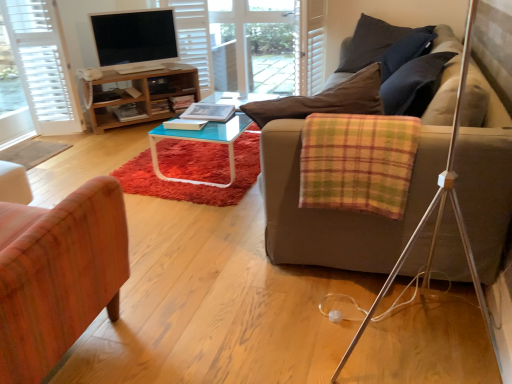
Question: From the image's perspective, is hardcover book at center, arranged as the first book when viewed from the front, located above or below transparent glass door at center?

Choices:
 (A) above
 (B) below

Answer: (B)

Question: Considering their positions, is hardcover book at center, which is the second book from back to front, located in front of or behind transparent glass door at center?

Choices:
 (A) front
 (B) behind

Answer: (A)

Question: Estimate the real-world distances between objects in this image. Which object is closer to the white textured door at left?

Choices:
 (A) wooden chair at left
 (B) wooden cabinet at upper left
 (C) plaid fabric blanket at right
 (D) hardcover book at center, arranged as the first book when viewed from the front
 (E) hardcover book at center, acting as the first book starting from the back

Answer: (B)

Question: Which of these objects is positioned farthest from the wooden chair at left?

Choices:
 (A) transparent glass door at center
 (B) hardcover book at center, which is the second book from back to front
 (C) dark blue fabric pillow at upper right
 (D) white textured door at left
 (E) plaid fabric blanket at right

Answer: (A)